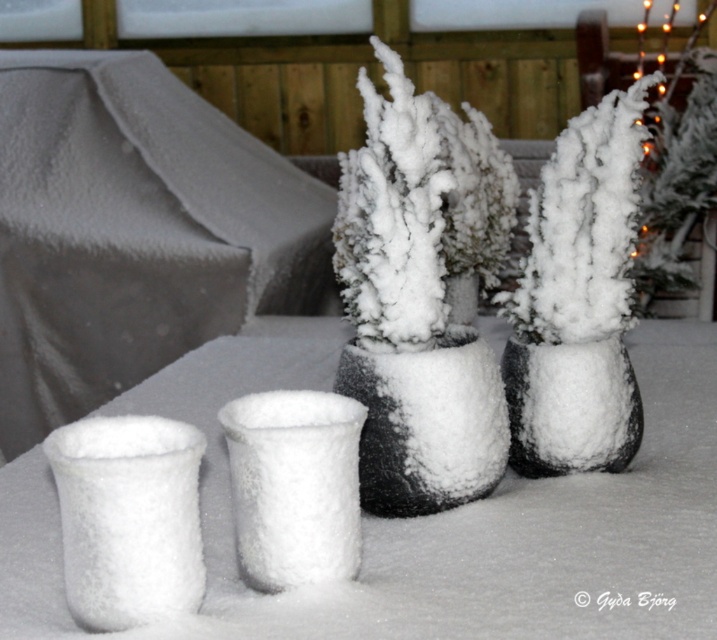
Consider the image. Can you confirm if white fluffy vase at lower left is positioned to the right of frosted ceramic vase at center?

No, white fluffy vase at lower left is not to the right of frosted ceramic vase at center.

Is point (130, 592) positioned in front of point (409, 412)?

Yes.

Between point (201, 564) and point (436, 452), which one is positioned in front?

Point (201, 564) is more forward.

Where is `white fluffy vase at lower left`? Image resolution: width=717 pixels, height=640 pixels. white fluffy vase at lower left is located at coordinates (128, 518).

Is point (361, 252) closer to camera compared to point (614, 392)?

Yes.

Does snow-covered plant at center appear over black matte vase at center?

Correct, snow-covered plant at center is located above black matte vase at center.

The height and width of the screenshot is (640, 717). I want to click on snow-covered plant at center, so click(x=409, y=317).

Does point (513, 316) come closer to viewer compared to point (285, 460)?

No, (513, 316) is further to viewer.

Does white frosted plant at center have a greater width compared to white fluffy vase at center?

Indeed, white frosted plant at center has a greater width compared to white fluffy vase at center.

Is point (511, 296) farther from viewer compared to point (290, 522)?

Yes, point (511, 296) is farther from viewer.

Locate an element on the screen. The height and width of the screenshot is (640, 717). white frosted plant at center is located at coordinates [x=579, y=300].